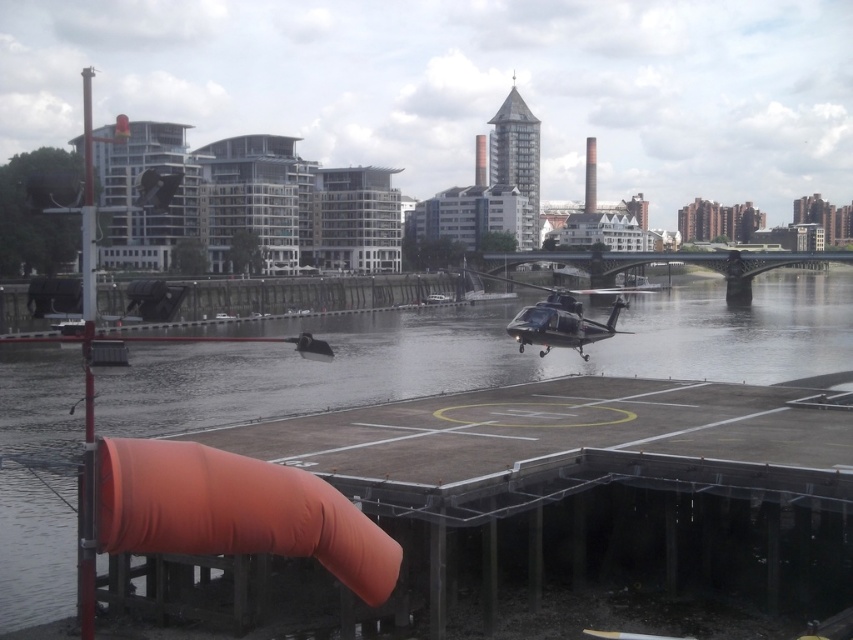
Question: Can you confirm if transparent water at center is positioned to the left of metallic silver helicopter at center?

Choices:
 (A) yes
 (B) no

Answer: (B)

Question: Does transparent water at center have a larger size compared to metallic silver helicopter at center?

Choices:
 (A) no
 (B) yes

Answer: (B)

Question: Which object is farther from the camera taking this photo?

Choices:
 (A) transparent water at center
 (B) metallic silver helicopter at center

Answer: (B)

Question: Does transparent water at center have a lesser width compared to metallic silver helicopter at center?

Choices:
 (A) no
 (B) yes

Answer: (A)